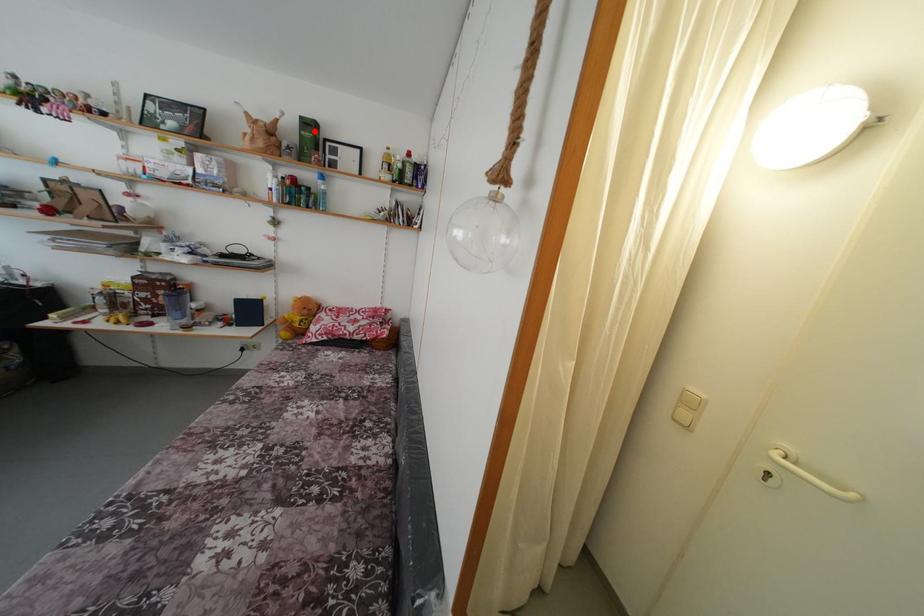
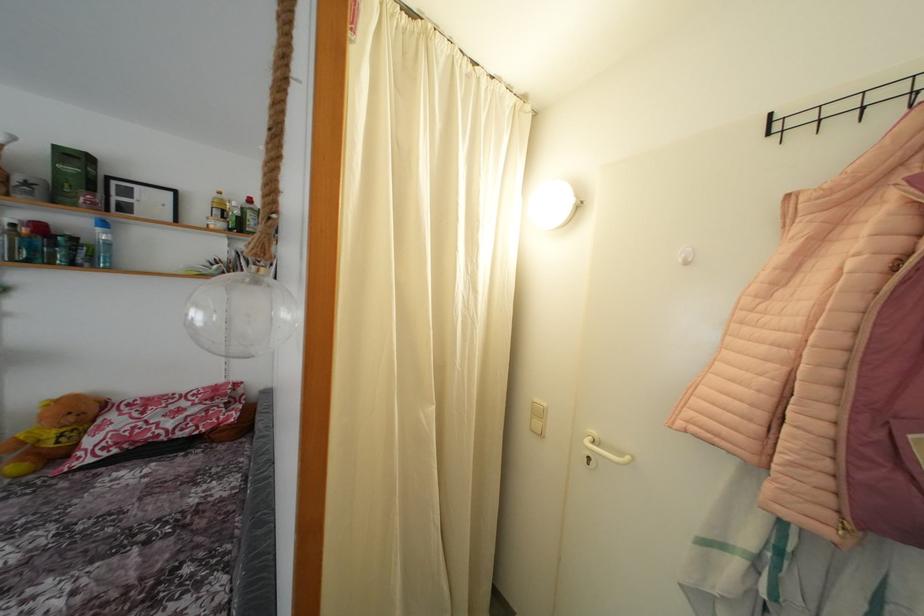
The point at the highlighted location is marked in the first image. Where is the corresponding point in the second image?

(80, 163)